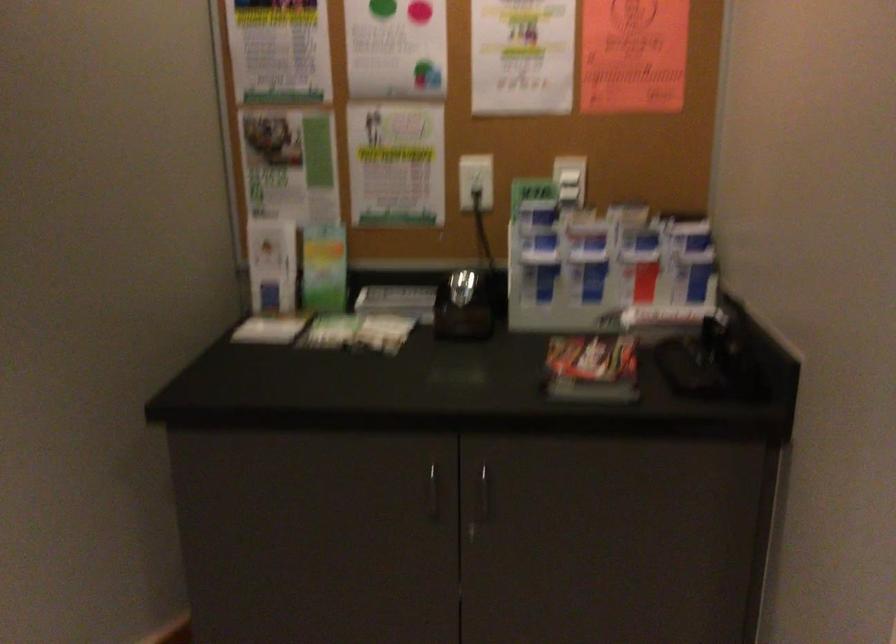
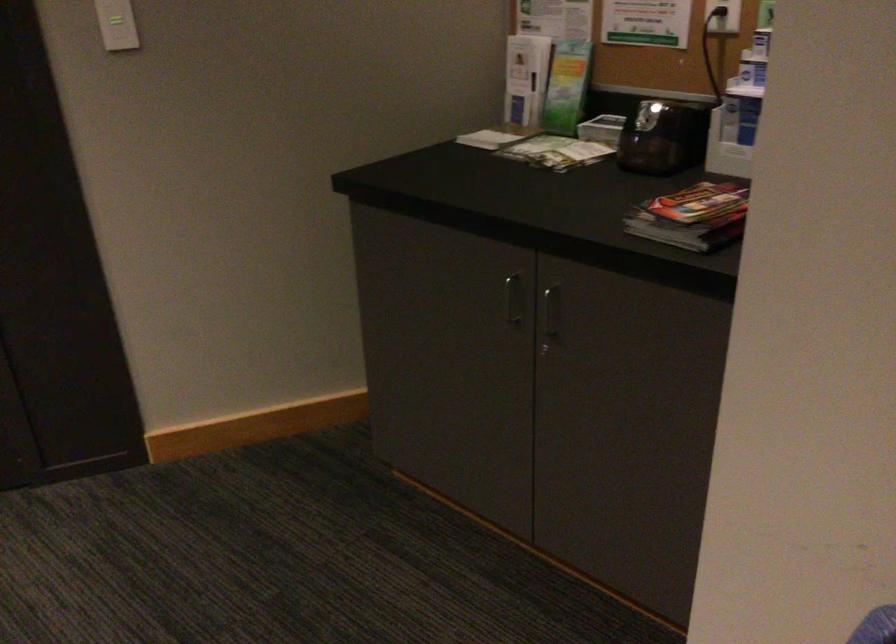
Question: The images are taken continuously from a first-person perspective. In which direction is your viewpoint rotating?

Choices:
 (A) Left
 (B) Right
 (C) Up
 (D) Down

Answer: (A)